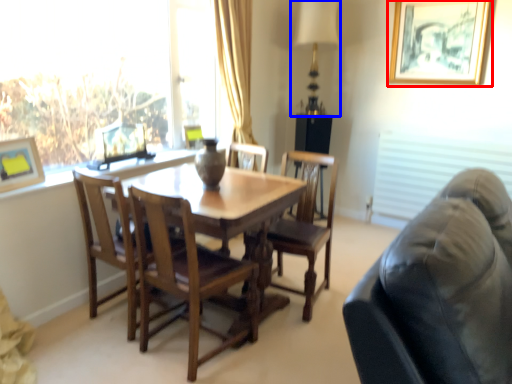
Question: Among these objects, which one is nearest to the camera, picture frame (highlighted by a red box) or table lamp (highlighted by a blue box)?

Choices:
 (A) picture frame
 (B) table lamp

Answer: (A)